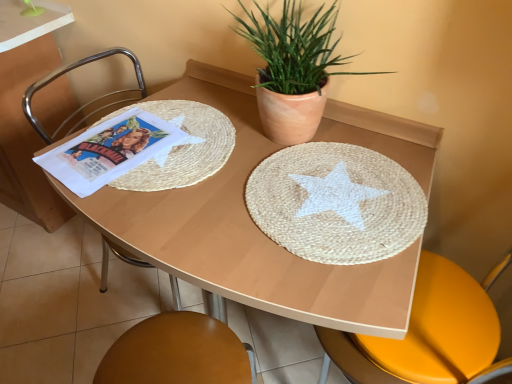
Find the location of `vacant region to the left of terracotta clay pot at upper center`. vacant region to the left of terracotta clay pot at upper center is located at coordinates [x=197, y=136].